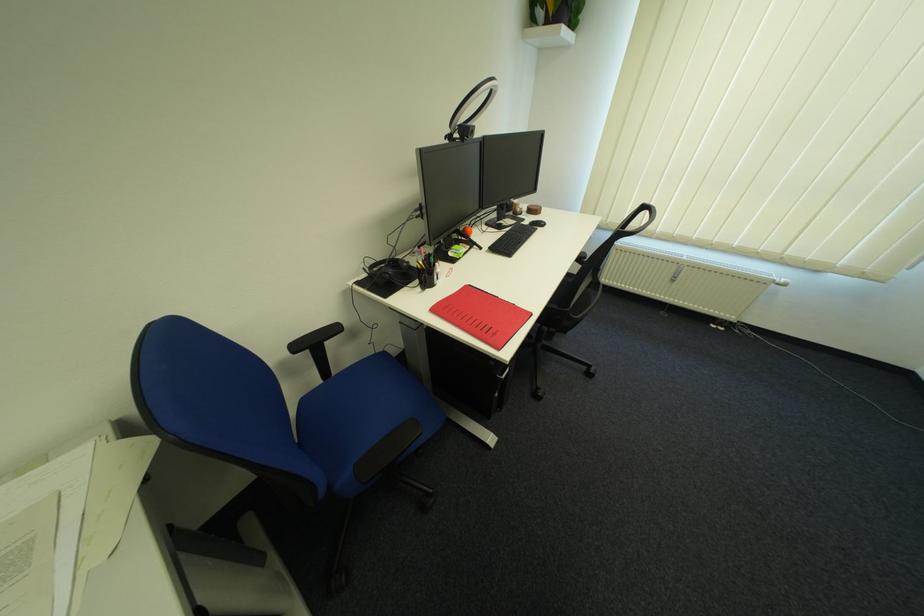
Image resolution: width=924 pixels, height=616 pixels. Describe the element at coordinates (634, 222) in the screenshot. I see `the black chair handle` at that location.